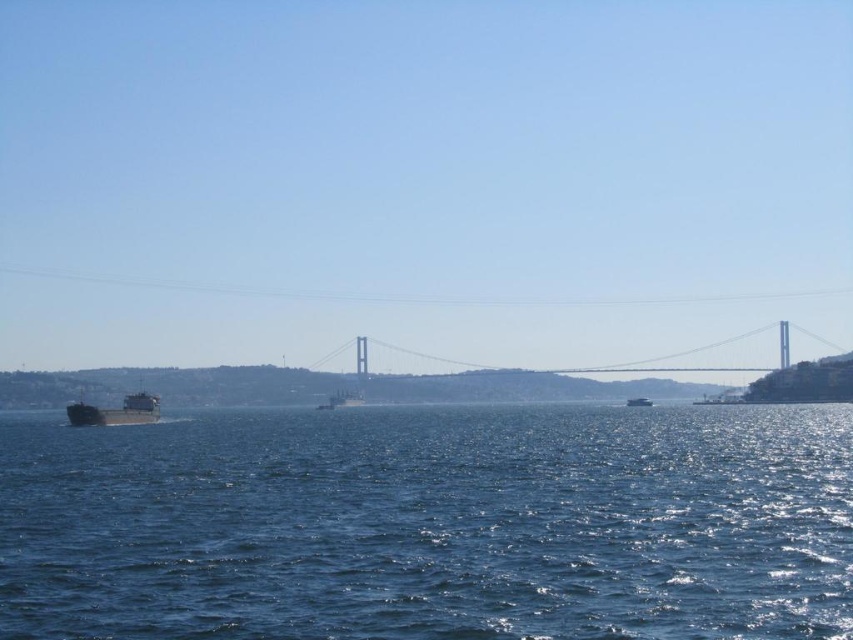
You are an observer standing on the shore looking out at the scene. Which object, the blue water at center or the metallic gray cargo ship at left, is positioned higher in the image?

The blue water at center is positioned higher in the image than the metallic gray cargo ship at left according to the description.

You are a photographer standing on the deck of the metallic gray cargo ship at left, aiming to capture the blue water at center in your shot. Considering the relative sizes of the objects in the scene, which object will appear wider in the photograph?

The blue water at center will appear wider in the photograph since its width surpasses that of the metallic gray cargo ship at left.

You are a photographer positioned at the edge of the water. You want to capture both the blue water at center and the metallic silver boat at center in your shot. Based on their positions, which object should you frame first to ensure both are in the image?

→ The blue water at center is to the left of the metallic silver boat at center, so you should frame the blue water at center first on the left side to include both in the shot.